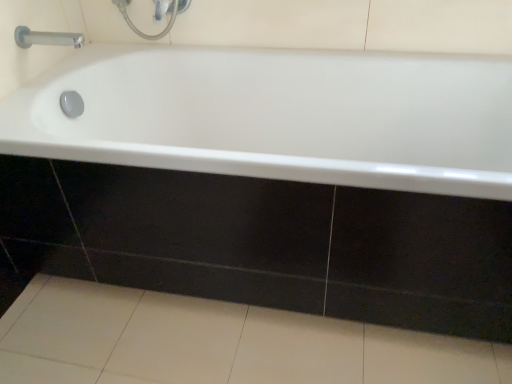
Question: Can white glossy bathtub at center be found inside satin chrome faucet at upper left?

Choices:
 (A) yes
 (B) no

Answer: (B)

Question: Can you confirm if satin chrome faucet at upper left is shorter than white glossy bathtub at center?

Choices:
 (A) no
 (B) yes

Answer: (B)

Question: Does satin chrome faucet at upper left lie behind white glossy bathtub at center?

Choices:
 (A) no
 (B) yes

Answer: (B)

Question: Is satin chrome faucet at upper left aimed at white glossy bathtub at center?

Choices:
 (A) no
 (B) yes

Answer: (A)

Question: Is satin chrome faucet at upper left positioned far away from white glossy bathtub at center?

Choices:
 (A) no
 (B) yes

Answer: (A)

Question: Does satin chrome faucet at upper left have a greater width compared to white glossy bathtub at center?

Choices:
 (A) yes
 (B) no

Answer: (B)

Question: Does white glossy bathtub at center touch white glossy tile at lower center?

Choices:
 (A) yes
 (B) no

Answer: (B)

Question: From the image's perspective, is white glossy bathtub at center on white glossy tile at lower center?

Choices:
 (A) no
 (B) yes

Answer: (B)

Question: Is white glossy bathtub at center facing towards white glossy tile at lower center?

Choices:
 (A) yes
 (B) no

Answer: (B)

Question: Is white glossy tile at lower center a part of white glossy bathtub at center?

Choices:
 (A) no
 (B) yes

Answer: (A)

Question: Is white glossy bathtub at center positioned with its back to white glossy tile at lower center?

Choices:
 (A) no
 (B) yes

Answer: (A)

Question: From a real-world perspective, is white glossy bathtub at center on white glossy tile at lower center?

Choices:
 (A) yes
 (B) no

Answer: (A)

Question: Can you confirm if white glossy bathtub at center is taller than satin chrome faucet at upper left?

Choices:
 (A) no
 (B) yes

Answer: (B)